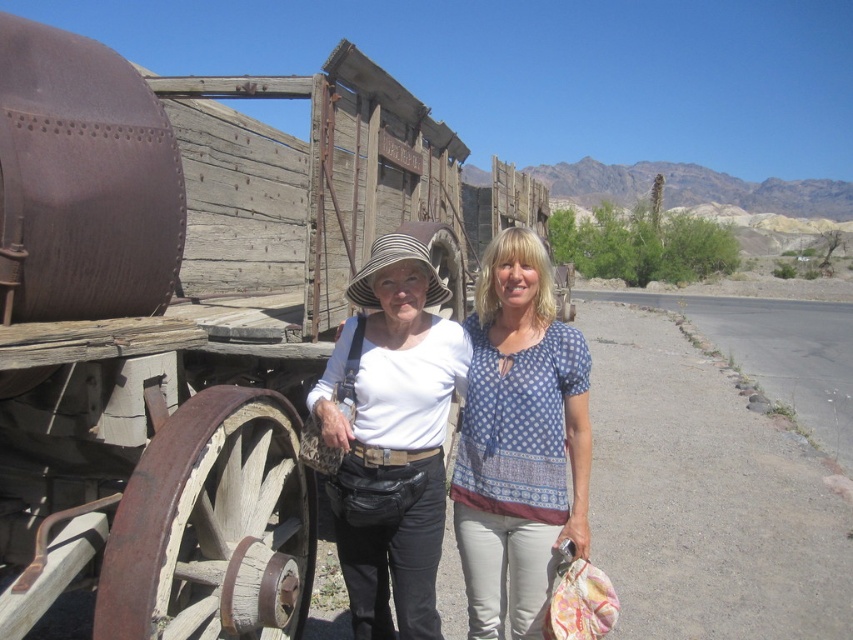
Consider the image. You are a photographer standing in the scene. You want to take a photo that includes both the rusty wood wagon at center and the white fabric blouse at center. Based on their positions, which object should you frame first to ensure both are in the shot?

The rusty wood wagon at center is positioned on the left side of white fabric blouse at center. To include both in the photo, you should frame the rusty wood wagon at center first as it is on the left, ensuring the white fabric blouse at center remains within the frame to the right.

You are a tailor observing the white fabric blouse at center and the striped fabric cowboy hat at center. Which item has a greater width?

The white fabric blouse at center has a greater width than the striped fabric cowboy hat at center.